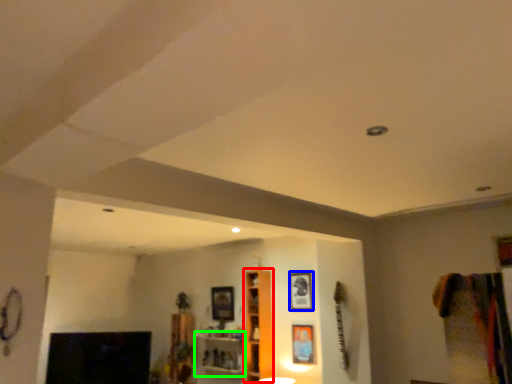
Question: Which is nearer to the cabinet (highlighted by a red box)? picture frame (highlighted by a blue box) or shelf (highlighted by a green box).

Choices:
 (A) picture frame
 (B) shelf

Answer: (A)